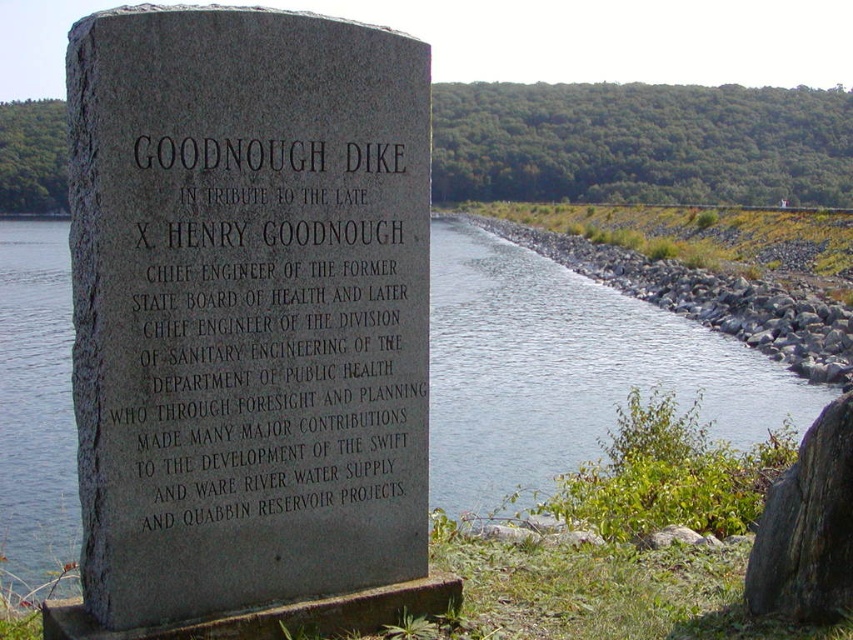
Question: Can you confirm if gray stone monument at center is positioned below clear water at center?

Choices:
 (A) no
 (B) yes

Answer: (B)

Question: Is clear water at center smaller than gray rough rock at right?

Choices:
 (A) yes
 (B) no

Answer: (B)

Question: Among these points, which one is farthest from the camera?

Choices:
 (A) (833, 595)
 (B) (77, 380)
 (C) (643, 291)
 (D) (480, 506)

Answer: (C)

Question: Which of these objects is positioned closest to the gray rock at center?

Choices:
 (A) gray stone monument at center
 (B) clear water at center

Answer: (B)

Question: Does gray rock at center lie behind gray rough rock at right?

Choices:
 (A) no
 (B) yes

Answer: (B)

Question: Which point is closer to the camera?

Choices:
 (A) gray rough rock at right
 (B) gray rock at center
 (C) clear water at center

Answer: (C)